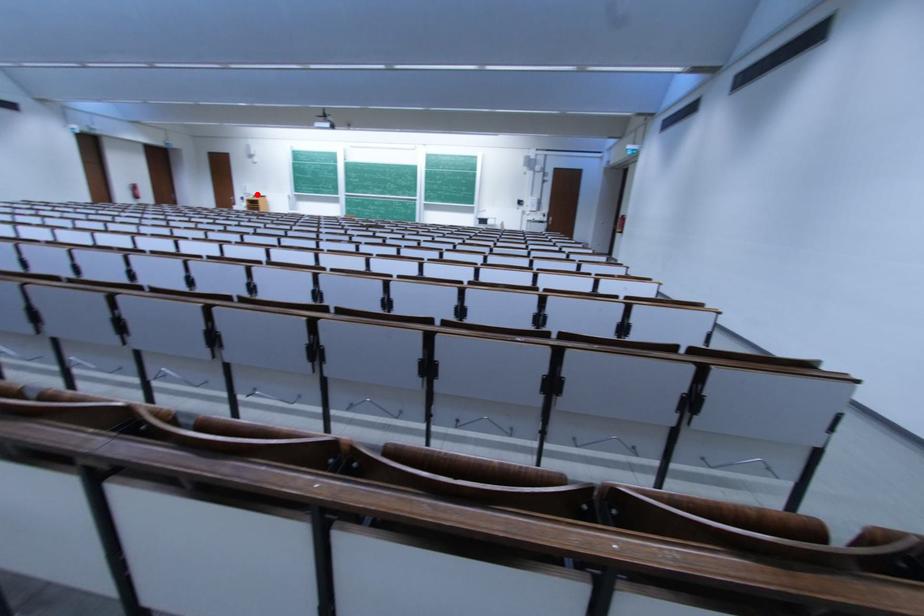
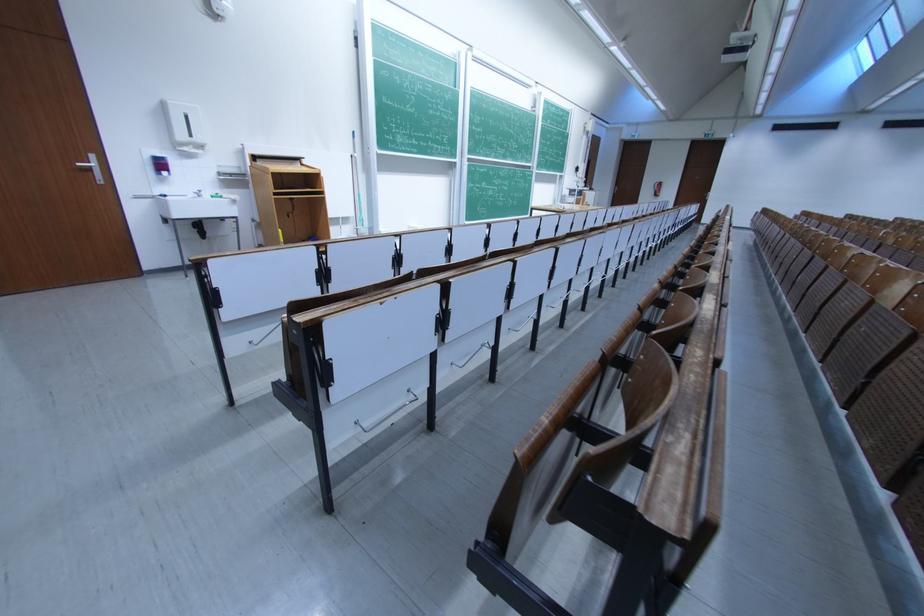
Where in the second image is the point corresponding to the highlighted location from the first image?

(205, 142)